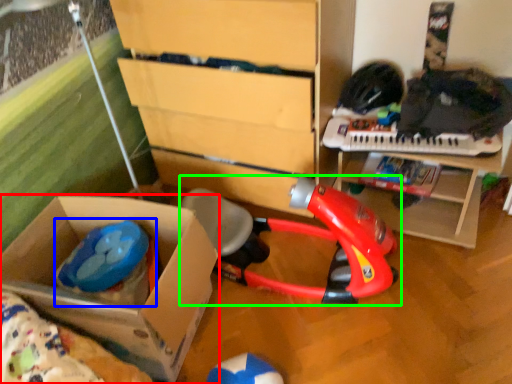
Question: Estimate the real-world distances between objects in this image. Which object is farther from box (highlighted by a red box), toy (highlighted by a blue box) or toy (highlighted by a green box)?

Choices:
 (A) toy
 (B) toy

Answer: (B)